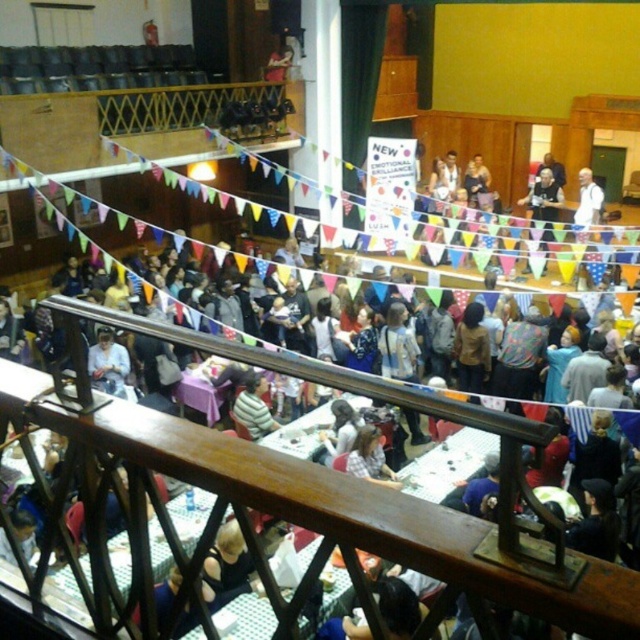
Question: Which point is closer to the camera?

Choices:
 (A) (592, 177)
 (B) (333, 451)
 (C) (113, 385)
 (D) (262, 388)

Answer: (B)

Question: In this image, where is light brown hair at center located relative to white shirt at upper right?

Choices:
 (A) below
 (B) above

Answer: (A)

Question: Among these objects, which one is nearest to the camera?

Choices:
 (A) plaid shirt at center
 (B) white shirt at upper right

Answer: (A)

Question: Can you confirm if matte white shirt at center is positioned above white shirt at upper right?

Choices:
 (A) yes
 (B) no

Answer: (B)

Question: Which point is closer to the camera?

Choices:
 (A) (349, 460)
 (B) (577, 218)

Answer: (A)

Question: Is plaid shirt at center above striped shirt at center?

Choices:
 (A) no
 (B) yes

Answer: (A)